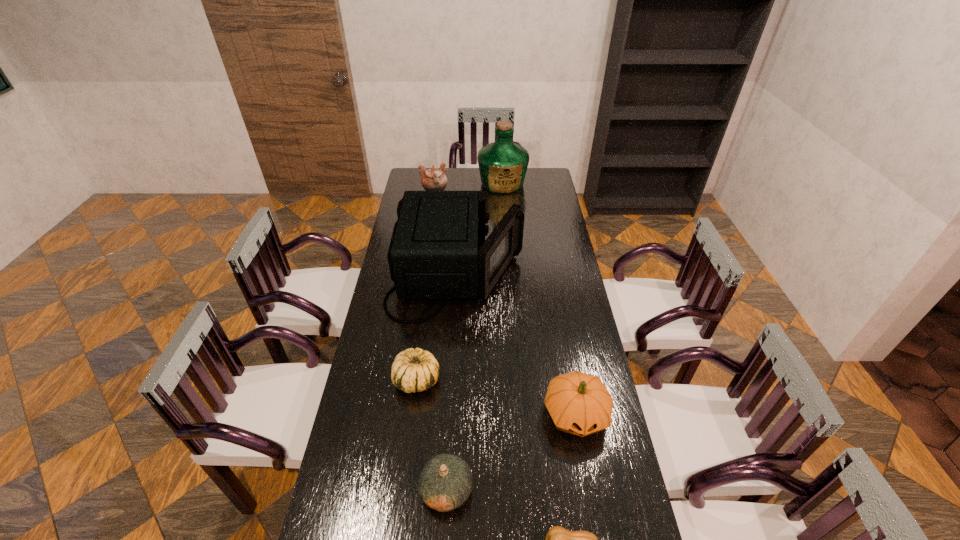
Locate an element on the screen. The height and width of the screenshot is (540, 960). free space located 0.280m on the right of the third farthest gourd is located at coordinates (573, 490).

Image resolution: width=960 pixels, height=540 pixels. Identify the location of object situated at the far edge. (502, 164).

Identify the location of microwave oven that is at the left edge. (x=434, y=253).

Identify the location of urn positioned at the left edge. (433, 179).

The image size is (960, 540). In order to click on gourd at the left edge in this screenshot , I will do `click(413, 370)`.

Image resolution: width=960 pixels, height=540 pixels. In order to click on liquor that is at the right edge in this screenshot , I will do `click(502, 164)`.

The image size is (960, 540). Identify the location of gourd at the right edge. (579, 403).

This screenshot has width=960, height=540. What are the coordinates of `object that is positioned at the far right corner` in the screenshot? It's located at (502, 164).

In the image, there is a desktop. At what (x,y) coordinates should I click in order to perform the action: click on vacant space at the far edge. Please return your answer as a coordinate pair (x, y). The image size is (960, 540). Looking at the image, I should click on (481, 185).

The width and height of the screenshot is (960, 540). Identify the location of vacant space at the left edge. coord(359,457).